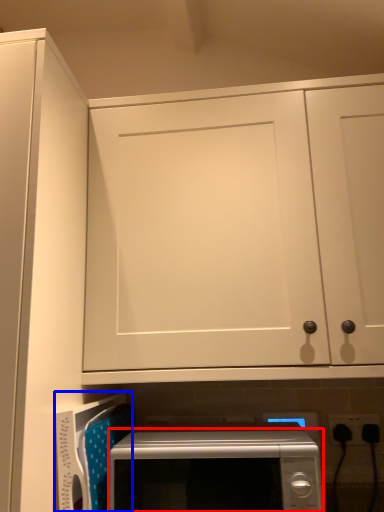
Question: Among these objects, which one is nearest to the camera, microwave oven (highlighted by a red box) or appliance (highlighted by a blue box)?

Choices:
 (A) microwave oven
 (B) appliance

Answer: (A)